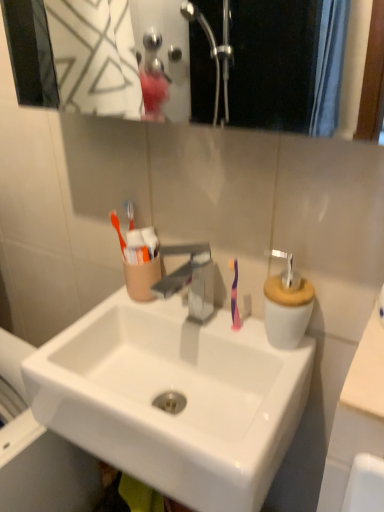
Question: Considering the relative positions of beige matte counter top at right, arranged as the 1th counter top when viewed from the right, and white glossy sink at center in the image provided, is beige matte counter top at right, arranged as the 1th counter top when viewed from the right, to the left or to the right of white glossy sink at center?

Choices:
 (A) left
 (B) right

Answer: (B)

Question: Is beige matte counter top at right, arranged as the second counter top when viewed from the left, inside or outside of white glossy sink at center?

Choices:
 (A) outside
 (B) inside

Answer: (A)

Question: Estimate the real-world distances between objects in this image. Which object is farther from the white ceramic soap dispenser at right?

Choices:
 (A) beige matte counter top at right, arranged as the 1th counter top when viewed from the right
 (B) white glossy sink at center
 (C) metallic silver faucet at center
 (D) white glossy counter top at lower right, arranged as the second counter top when viewed from the right
 (E) purple glossy toothbrush at center

Answer: (B)

Question: Considering the real-world distances, which object is closest to the metallic silver faucet at center?

Choices:
 (A) beige matte counter top at right, arranged as the 1th counter top when viewed from the right
 (B) white ceramic soap dispenser at right
 (C) white glossy counter top at lower right, arranged as the 1th counter top when viewed from the left
 (D) purple glossy toothbrush at center
 (E) white glossy sink at center

Answer: (D)